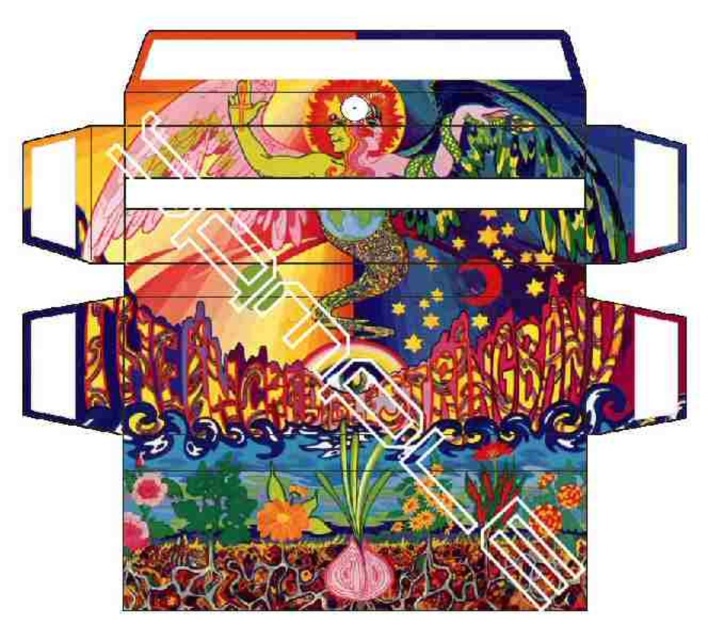
You are designing a paper craft box based on the image. You need to place a sticker on the lower part of the box. Which flower should you choose between the matte pink flower at lower left and the orange matte flower at center?

The matte pink flower at lower left is located below the orange matte flower at center, so you should choose the matte pink flower at lower left for the lower part of the box.

You are designing a paper craft box and need to place a sticker on the box. The sticker is exactly the same size as the orange matte flower at center. Will the sticker fit on the matte pink flower at lower left without overlapping?

The matte pink flower at lower left is larger than the orange matte flower at center, so the sticker will fit on the matte pink flower at lower left without overlapping.